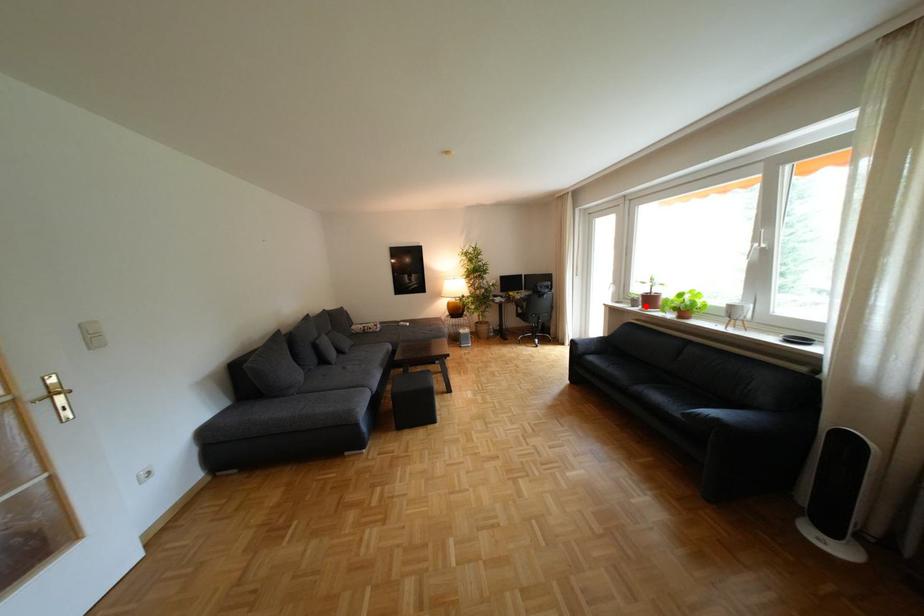
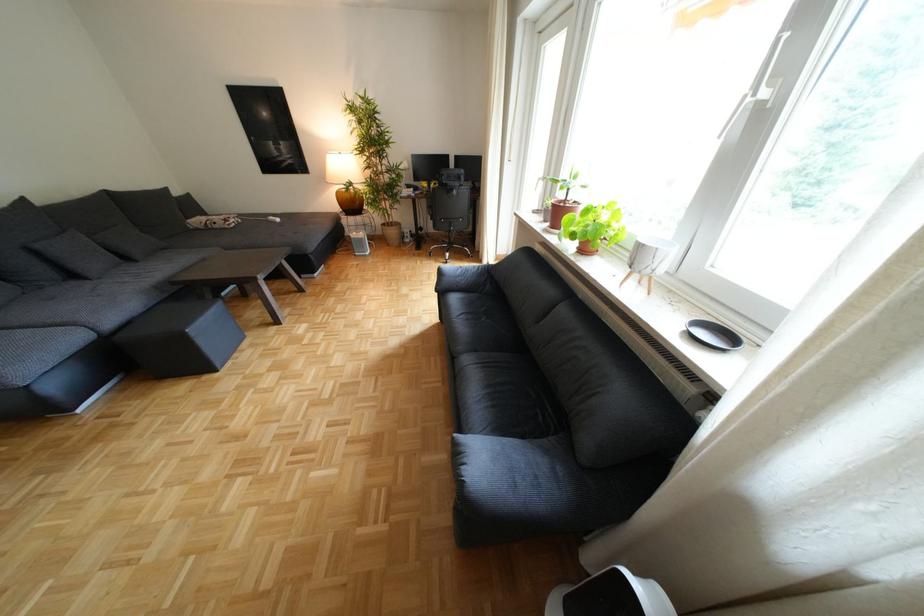
Where in the second image is the point corresponding to the highlighted location from the first image?

(558, 220)